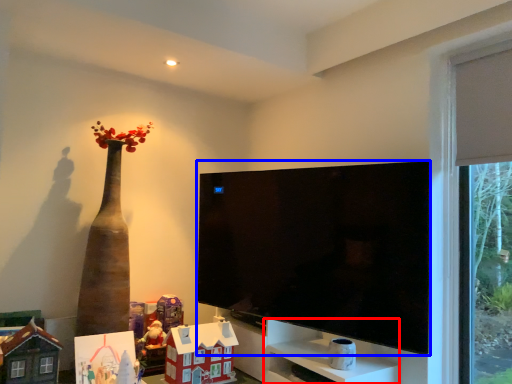
Question: Which object appears farthest to the camera in this image, cabinet (highlighted by a red box) or television (highlighted by a blue box)?

Choices:
 (A) cabinet
 (B) television

Answer: (A)